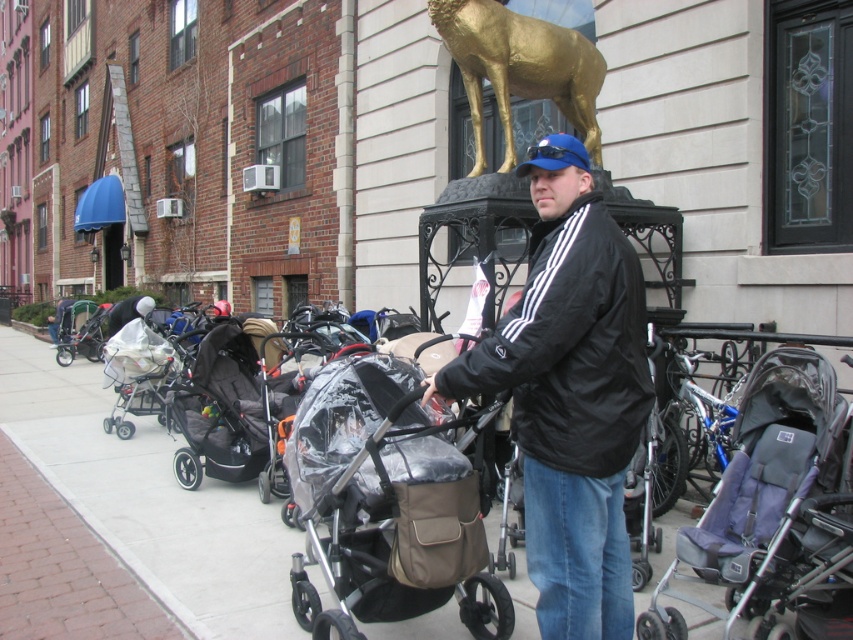
Question: Among these points, which one is nearest to the camera?

Choices:
 (A) (579, 292)
 (B) (561, 141)
 (C) (752, 630)
 (D) (500, 3)

Answer: (A)

Question: Which object appears farthest from the camera in this image?

Choices:
 (A) gray fabric stroller at center
 (B) blue fabric baseball cap at center
 (C) smooth concrete sidewalk at center
 (D) gold metallic statue at upper center

Answer: (D)

Question: Is black matte jacket at center positioned in front of gold metallic statue at upper center?

Choices:
 (A) yes
 (B) no

Answer: (A)

Question: Can you confirm if clear plastic baby carriage at center is positioned below gold metallic statue at upper center?

Choices:
 (A) yes
 (B) no

Answer: (A)

Question: Is clear plastic baby carriage at center to the left of blue fabric baseball cap at center from the viewer's perspective?

Choices:
 (A) no
 (B) yes

Answer: (B)

Question: Which point appears closest to the camera in this image?

Choices:
 (A) (387, 627)
 (B) (766, 634)
 (C) (535, 257)

Answer: (C)